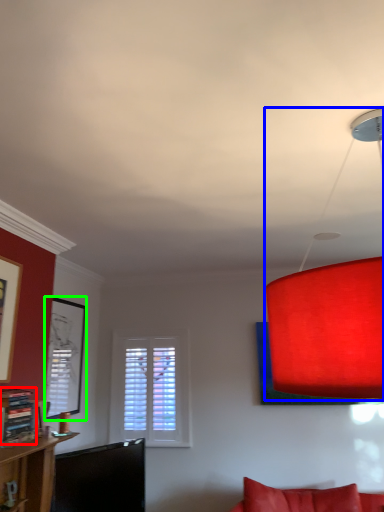
Question: Which object is the closest to the shelf (highlighted by a red box)? Choose among these: lamp (highlighted by a blue box) or picture frame (highlighted by a green box).

Choices:
 (A) lamp
 (B) picture frame

Answer: (B)